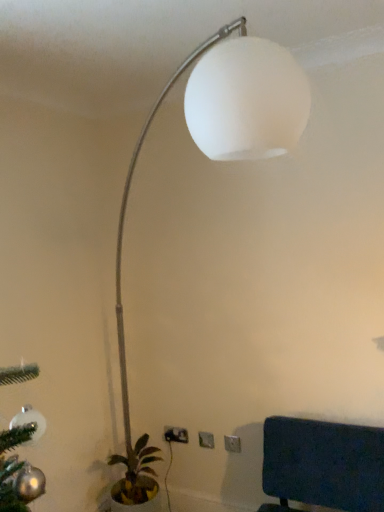
Question: From their relative heights in the image, would you say white matte lamp at upper center is taller or shorter than white plastic electric outlet at lower center, which is counted as the 1th electric outlet, starting from the front?

Choices:
 (A) short
 (B) tall

Answer: (B)

Question: Considering the relative positions of white matte lamp at upper center and white plastic electric outlet at lower center, which is counted as the 1th electric outlet, starting from the front, in the image provided, is white matte lamp at upper center to the left or to the right of white plastic electric outlet at lower center, which is counted as the 1th electric outlet, starting from the front,?

Choices:
 (A) right
 (B) left

Answer: (B)

Question: Which is farther from the white plastic electric outlet at lower center, placed as the second electric outlet when sorted from left to right?

Choices:
 (A) matte gray outlet at lower center, the 1th electric outlet when ordered from back to front
 (B) green leafy plant in pot at lower left
 (C) white matte lamp at upper center
 (D) dark blue fabric at lower right
 (E) white plastic electric outlet at lower center, the third electric outlet positioned from the left

Answer: (C)

Question: Which object is the closest to the white matte lamp at upper center?

Choices:
 (A) matte gray outlet at lower center, which appears as the 3th electric outlet when viewed from the right
 (B) dark blue fabric at lower right
 (C) green leafy plant in pot at lower left
 (D) white plastic electric outlet at lower center, placed as the second electric outlet when sorted from left to right
 (E) white plastic electric outlet at lower center, the third electric outlet positioned from the left

Answer: (C)